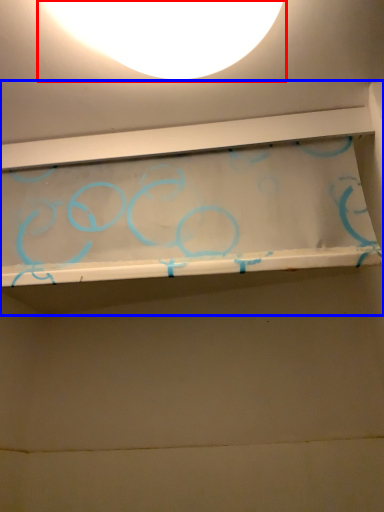
Question: Which object is closer to the camera taking this photo, lamp (highlighted by a red box) or shelf (highlighted by a blue box)?

Choices:
 (A) lamp
 (B) shelf

Answer: (A)